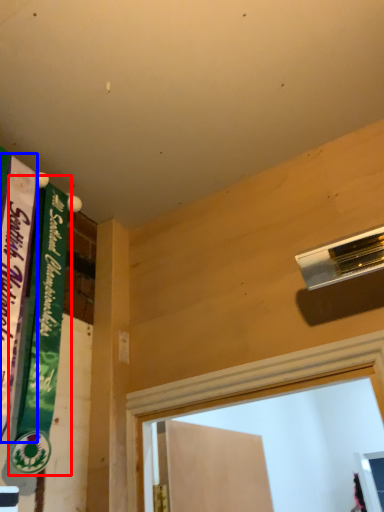
Question: Which object appears closest to the camera in this image, bulletin board (highlighted by a red box) or bulletin board (highlighted by a blue box)?

Choices:
 (A) bulletin board
 (B) bulletin board

Answer: (B)